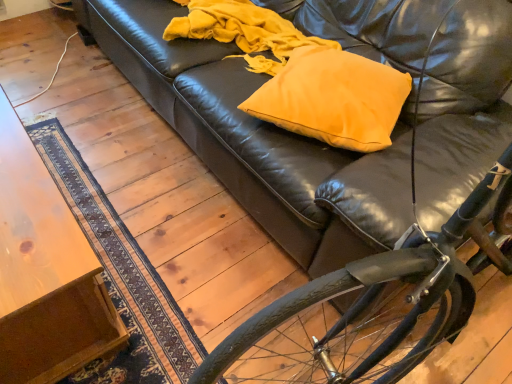
Question: Is shiny black bicycle at lower right spatially inside matte yellow pillow at center, or outside of it?

Choices:
 (A) inside
 (B) outside

Answer: (B)

Question: Considering the relative positions of shiny black bicycle at lower right and matte yellow pillow at center in the image provided, is shiny black bicycle at lower right to the left or to the right of matte yellow pillow at center?

Choices:
 (A) left
 (B) right

Answer: (B)

Question: Which of these objects is positioned farthest from the matte yellow pillow at center?

Choices:
 (A) wooden table at lower left
 (B) shiny black bicycle at lower right

Answer: (A)

Question: Which of these objects is positioned farthest from the matte yellow pillow at center?

Choices:
 (A) shiny black bicycle at lower right
 (B) wooden table at lower left

Answer: (B)